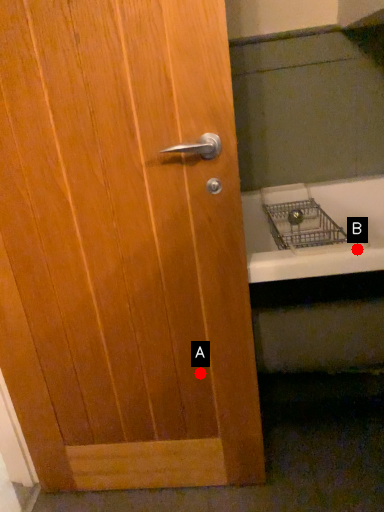
Question: Two points are circled on the image, labeled by A and B beside each circle. Which point is farther from the camera taking this photo?

Choices:
 (A) A is further
 (B) B is further

Answer: (A)